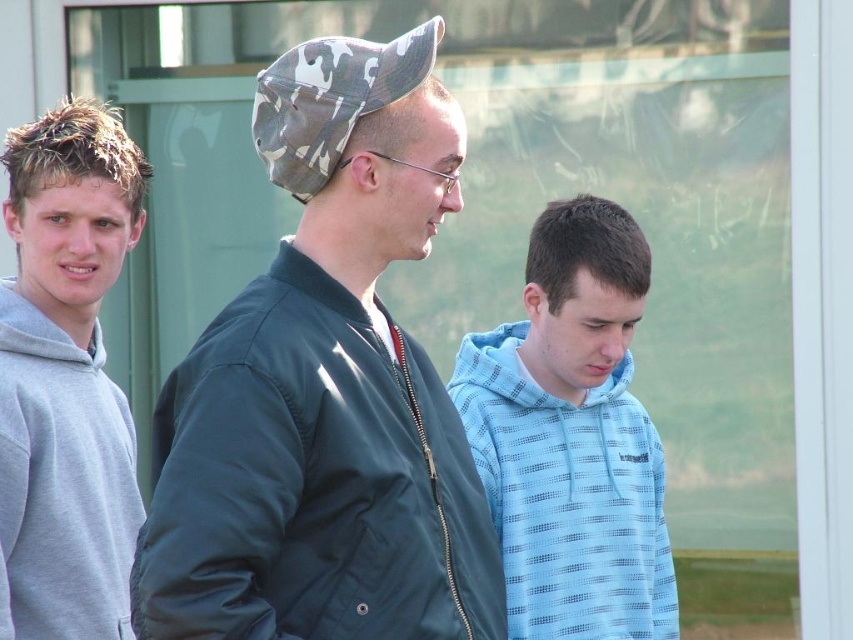
Question: Is dark green jacket at center further to camera compared to light blue hoodie at center?

Choices:
 (A) no
 (B) yes

Answer: (A)

Question: Can you confirm if dark green jacket at center is positioned below light blue hoodie at center?

Choices:
 (A) no
 (B) yes

Answer: (A)

Question: Which of these objects is positioned farthest from the camouflage fabric baseball cap at center?

Choices:
 (A) dark green jacket at center
 (B) light blue hoodie at center
 (C) gray fleece hoodie at left

Answer: (C)

Question: Can you confirm if light blue hoodie at center is bigger than gray fleece hoodie at left?

Choices:
 (A) no
 (B) yes

Answer: (A)

Question: Considering the real-world distances, which object is farthest from the camouflage fabric baseball cap at center?

Choices:
 (A) gray fleece hoodie at left
 (B) light blue hoodie at center

Answer: (A)

Question: Which point is farther to the camera?

Choices:
 (A) gray fleece hoodie at left
 (B) camouflage fabric baseball cap at center

Answer: (A)